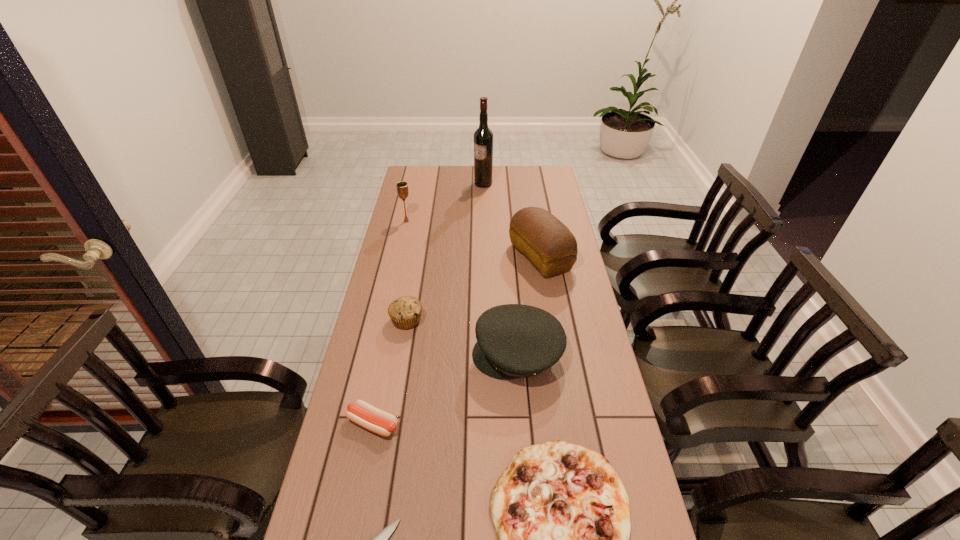
You are a GUI agent. You are given a task and a screenshot of the screen. Output one action in this format:
    pyautogui.click(x=<x>, y=<y>)
    Task: Click on the free spot between the sausage and the third farthest object
    Image resolution: width=960 pixels, height=540 pixels.
    Given the screenshot: What is the action you would take?
    (x=457, y=340)

Identify the location of vacant space in between the sausage and the chalice. This screenshot has width=960, height=540. (390, 322).

Where is `object that can be found as the closest to the seventh nearest object`? object that can be found as the closest to the seventh nearest object is located at coordinates (x=483, y=137).

Identify the location of object that stands as the closest to the pizza. Image resolution: width=960 pixels, height=540 pixels. (514, 341).

This screenshot has width=960, height=540. In order to click on free point that satisfies the following two spatial constraints: 1. on the back side of the fifth tallest object; 2. on the left side of the bread in this screenshot , I will do `click(418, 257)`.

Find the location of a particular element. vacant space that satisfies the following two spatial constraints: 1. on the front and back of the sixth nearest object; 2. on the left side of the tallest object is located at coordinates (484, 257).

The height and width of the screenshot is (540, 960). In order to click on vacant space that satisfies the following two spatial constraints: 1. on the back side of the muffin; 2. on the right side of the sausage in this screenshot , I will do `click(395, 320)`.